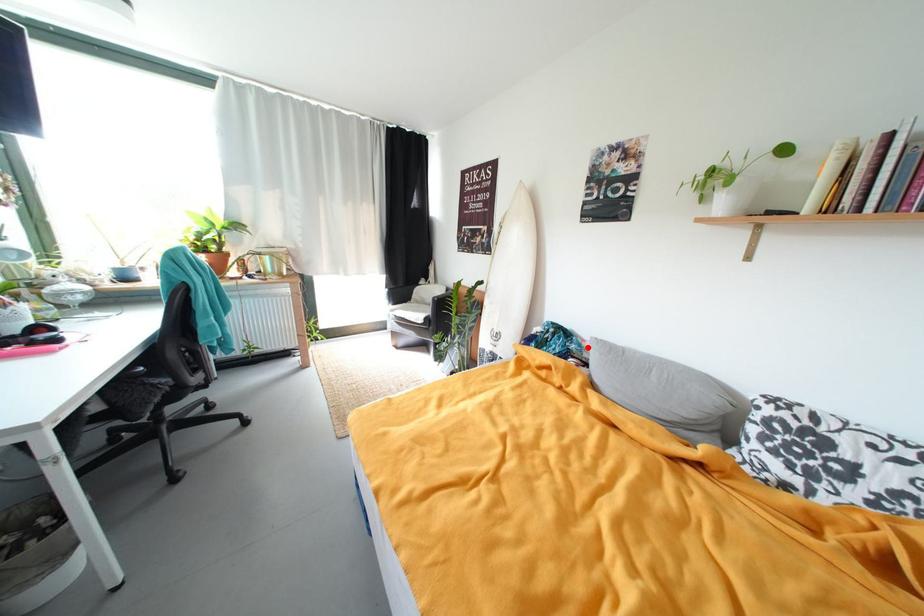
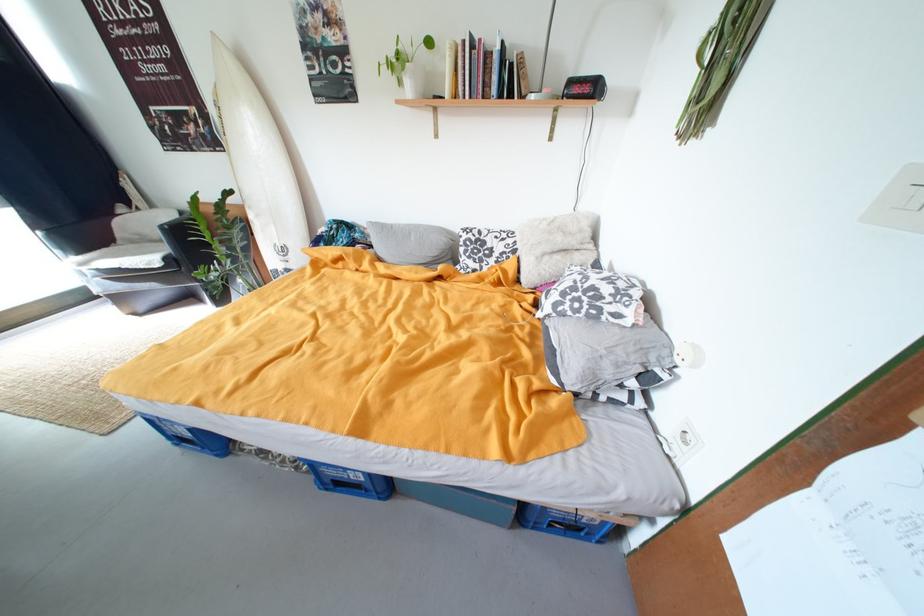
The point at the highlighted location is marked in the first image. Where is the corresponding point in the second image?

(371, 235)